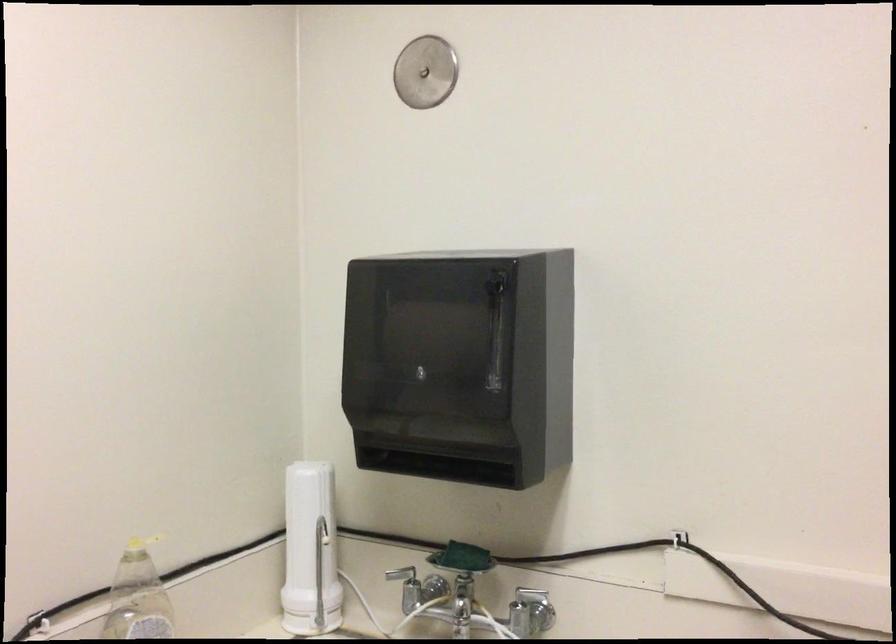
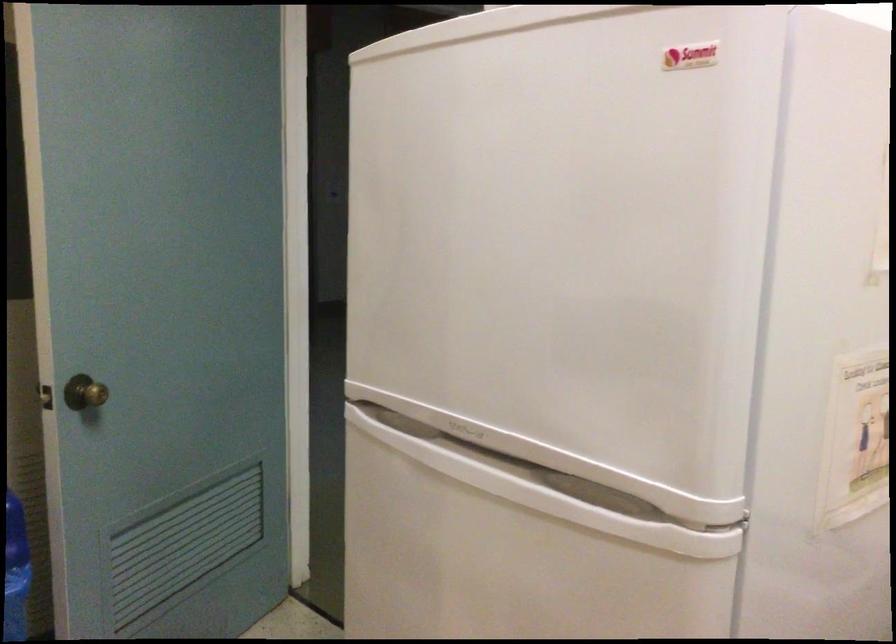
Question: The first image is from the beginning of the video and the second image is from the end. How did the camera likely rotate when shooting the video?

Choices:
 (A) Left
 (B) Right
 (C) Up
 (D) Down

Answer: (A)